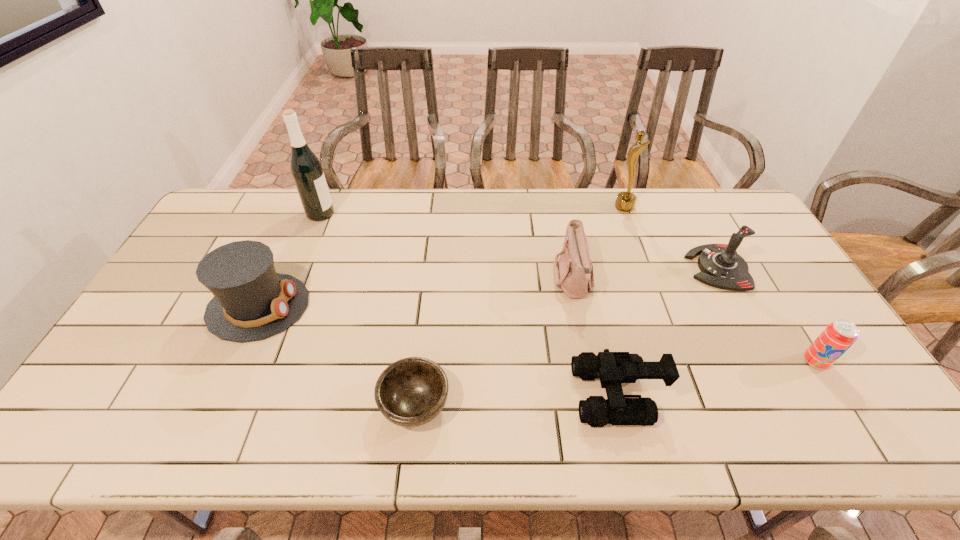
At what (x,y) coordinates should I click in order to perform the action: click on free location located 0.160m on the label of the wine bottle. Please return your answer as a coordinate pair (x, y). Looking at the image, I should click on (379, 214).

You are a GUI agent. You are given a task and a screenshot of the screen. Output one action in this format:
    pyautogui.click(x=<x>, y=<y>)
    Task: Click on the free region located 0.180m on the front-facing side of the sixth object from left to right
    This screenshot has width=960, height=540.
    Given the screenshot: What is the action you would take?
    (564, 207)

You are a GUI agent. You are given a task and a screenshot of the screen. Output one action in this format:
    pyautogui.click(x=<x>, y=<y>)
    Task: Click on the free space located 0.120m on the front-facing side of the sixth object from left to right
    The image size is (960, 540).
    Given the screenshot: What is the action you would take?
    pyautogui.click(x=582, y=207)

You are a GUI agent. You are given a task and a screenshot of the screen. Output one action in this format:
    pyautogui.click(x=<x>, y=<y>)
    Task: Click on the free spot located on the front-facing side of the sixth object from left to right
    The height and width of the screenshot is (540, 960).
    Given the screenshot: What is the action you would take?
    pyautogui.click(x=570, y=207)

Image resolution: width=960 pixels, height=540 pixels. Identify the location of vacant space located with goggles on the front of the dress hat. (344, 307).

Identify the location of vacant position located 0.190m on the handle side of the joystick. (627, 268).

Find the location of a particular element. free space located on the handle side of the joystick is located at coordinates (608, 268).

You are a GUI agent. You are given a task and a screenshot of the screen. Output one action in this format:
    pyautogui.click(x=<x>, y=<y>)
    Task: Click on the vacant space located 0.310m on the handle side of the joystick
    The width and height of the screenshot is (960, 540).
    Given the screenshot: What is the action you would take?
    pyautogui.click(x=588, y=268)

This screenshot has width=960, height=540. Find the location of `vacant area situated 0.240m on the front pocket of the shoulder bag`. vacant area situated 0.240m on the front pocket of the shoulder bag is located at coordinates (474, 281).

You are a GUI agent. You are given a task and a screenshot of the screen. Output one action in this format:
    pyautogui.click(x=<x>, y=<y>)
    Task: Click on the vacant space located 0.050m on the front pocket of the shoulder bag
    Image resolution: width=960 pixels, height=540 pixels.
    Given the screenshot: What is the action you would take?
    pyautogui.click(x=537, y=281)